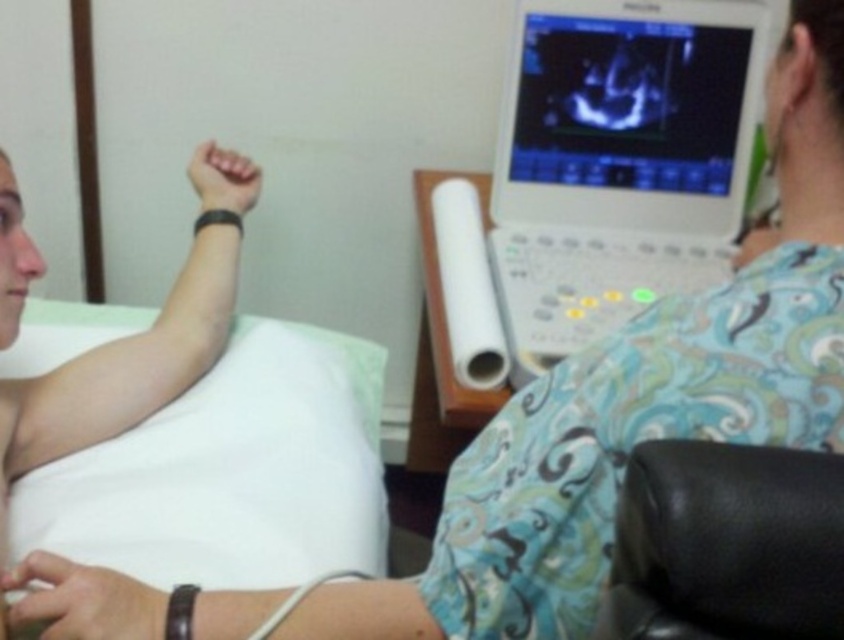
Question: Which object is positioned closest to the black leather armchair at lower right?

Choices:
 (A) matte plastic monitor at upper right
 (B) white fabric bed at upper left

Answer: (B)

Question: Does white fabric bed at upper left lie behind black leather armchair at lower right?

Choices:
 (A) yes
 (B) no

Answer: (A)

Question: From the image, what is the correct spatial relationship of white fabric bed at upper left in relation to matte plastic monitor at upper right?

Choices:
 (A) below
 (B) above

Answer: (A)

Question: Which of the following is the farthest from the observer?

Choices:
 (A) matte plastic monitor at upper right
 (B) white fabric bed at upper left
 (C) black leather armchair at lower right

Answer: (A)

Question: Which of the following is the closest to the observer?

Choices:
 (A) matte plastic monitor at upper right
 (B) black leather armchair at lower right

Answer: (B)

Question: Can you confirm if white fabric bed at upper left is positioned below matte plastic monitor at upper right?

Choices:
 (A) yes
 (B) no

Answer: (A)